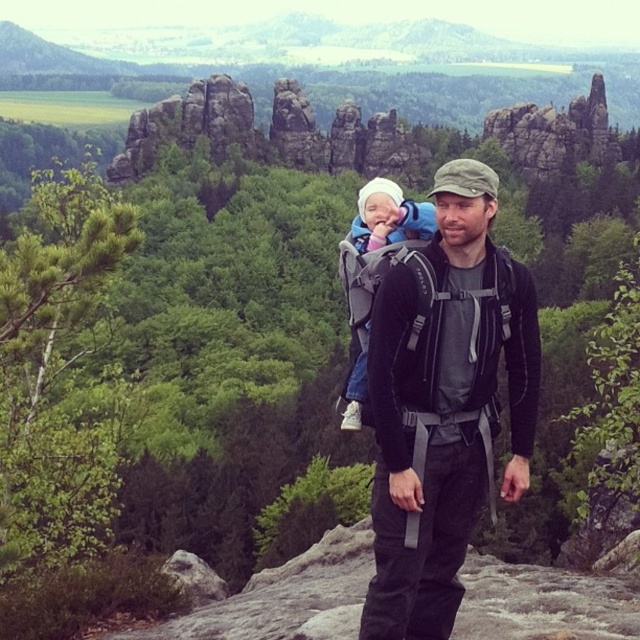
Question: Is white fleece baby carrier at center to the left of white fleece baby at center from the viewer's perspective?

Choices:
 (A) yes
 (B) no

Answer: (A)

Question: Which point is closer to the camera?

Choices:
 (A) (452, 493)
 (B) (388, 232)
 (C) (396, 184)

Answer: (A)

Question: Is black fabric backpack at center to the right of white fleece baby at center from the viewer's perspective?

Choices:
 (A) no
 (B) yes

Answer: (B)

Question: Which object is closer to the camera taking this photo?

Choices:
 (A) black fabric backpack at center
 (B) white fleece baby at center
 (C) white fleece baby carrier at center

Answer: (A)

Question: Which object is positioned farthest from the white fleece baby at center?

Choices:
 (A) white fleece baby carrier at center
 (B) black fabric backpack at center

Answer: (B)

Question: Is white fleece baby carrier at center smaller than white fleece baby at center?

Choices:
 (A) yes
 (B) no

Answer: (B)